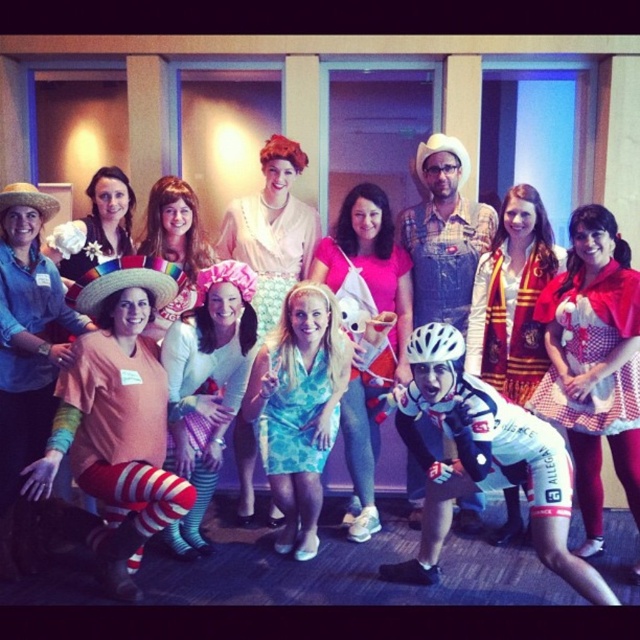
Question: Which object is farther from the camera taking this photo?

Choices:
 (A) rainbow striped socks at lower left
 (B) white matte bicycle helmet at center
 (C) polka dot dress at center

Answer: (C)

Question: Is matte peach shirt at center further to the viewer compared to white glossy helmet at center?

Choices:
 (A) no
 (B) yes

Answer: (B)

Question: Where is teal floral dress at center located in relation to pastel striped socks at lower left in the image?

Choices:
 (A) left
 (B) right

Answer: (B)

Question: Among these points, which one is nearest to the camera?

Choices:
 (A) (513, 502)
 (B) (440, 532)

Answer: (B)

Question: Is matte white dress at center smaller than matte peach dress at center?

Choices:
 (A) yes
 (B) no

Answer: (B)

Question: Which point is farther to the camera?

Choices:
 (A) teal floral dress at center
 (B) polka dot dress at center
 (C) matte peach shirt at center

Answer: (A)